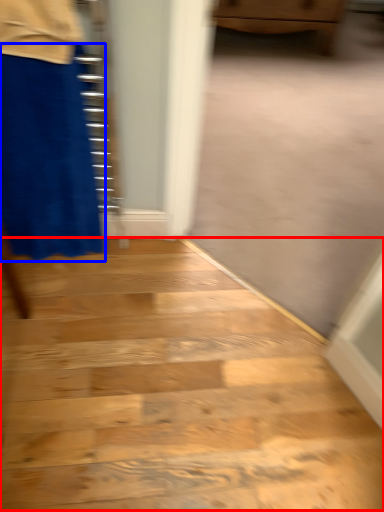
Question: Which point is closer to the camera, stairwell (highlighted by a red box) or miniskirt (highlighted by a blue box)?

Choices:
 (A) stairwell
 (B) miniskirt

Answer: (B)